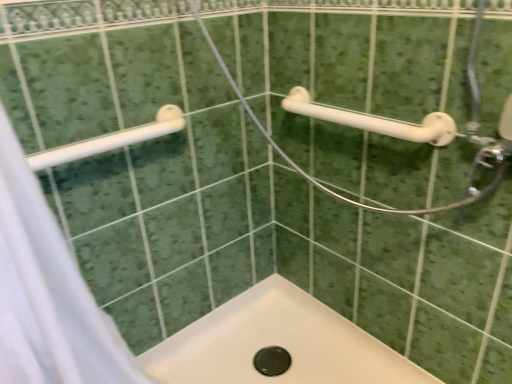
This screenshot has width=512, height=384. Identify the location of white plastic towel rack at upper left, the 2th towel rack viewed from the right. (111, 140).

What is the approximate width of white plastic towel rack at upper left, the 2th towel rack viewed from the right?

It is 4.54 inches.

Based on the photo, in order to face white fabric shower curtain at left, should I rotate leftwards or rightwards?

It's best to rotate left around 23.822 degrees.

The image size is (512, 384). Identify the location of white plastic towel rack at upper left, the 2th towel rack viewed from the right. (111, 140).

Considering the sizes of objects white fabric shower curtain at left and white plastic towel rack at upper left, the 2th towel rack viewed from the right, in the image provided, who is bigger, white fabric shower curtain at left or white plastic towel rack at upper left, the 2th towel rack viewed from the right,?

white fabric shower curtain at left is bigger.

What's the angular difference between white fabric shower curtain at left and white plastic towel rack at upper left, positioned as the 1th towel rack in left-to-right order,'s facing directions?

The facing directions of white fabric shower curtain at left and white plastic towel rack at upper left, positioned as the 1th towel rack in left-to-right order, are 3.91 degrees apart.

Which object is closer to the camera taking this photo, white fabric shower curtain at left or white plastic towel rack at upper left, positioned as the 1th towel rack in left-to-right order?

Positioned in front is white fabric shower curtain at left.

Consider the image. Is white fabric shower curtain at left next to white plastic towel rack at upper left, the 2th towel rack viewed from the right, and touching it?

No, white fabric shower curtain at left is not next to white plastic towel rack at upper left, the 2th towel rack viewed from the right.

Considering the points (14, 315) and (441, 132), which point is behind, point (14, 315) or point (441, 132)?

The point (441, 132) is behind.

From the image's perspective, which is above, white fabric shower curtain at left or white plastic grab bar at upper right, acting as the first towel rack starting from the right?

white plastic grab bar at upper right, acting as the first towel rack starting from the right, from the image's perspective.

Is the depth of white fabric shower curtain at left less than that of white plastic grab bar at upper right, acting as the first towel rack starting from the right?

Yes, the depth of white fabric shower curtain at left is less than that of white plastic grab bar at upper right, acting as the first towel rack starting from the right.

Consider the image. Are white fabric shower curtain at left and white plastic grab bar at upper right, placed as the 2th towel rack when sorted from left to right, far apart?

white fabric shower curtain at left is near white plastic grab bar at upper right, placed as the 2th towel rack when sorted from left to right, not far away.

Does white plastic grab bar at upper right, placed as the 2th towel rack when sorted from left to right, touch white plastic towel rack at upper left, the 2th towel rack viewed from the right?

white plastic grab bar at upper right, placed as the 2th towel rack when sorted from left to right, and white plastic towel rack at upper left, the 2th towel rack viewed from the right, are clearly separated.

Can you confirm if white plastic grab bar at upper right, acting as the first towel rack starting from the right, is shorter than white plastic towel rack at upper left, the 2th towel rack viewed from the right?

Incorrect, the height of white plastic grab bar at upper right, acting as the first towel rack starting from the right, does not fall short of that of white plastic towel rack at upper left, the 2th towel rack viewed from the right.

From the image's perspective, is white plastic grab bar at upper right, acting as the first towel rack starting from the right, below white plastic towel rack at upper left, positioned as the 1th towel rack in left-to-right order?

No.

Between white plastic grab bar at upper right, acting as the first towel rack starting from the right, and white plastic towel rack at upper left, positioned as the 1th towel rack in left-to-right order, which one appears on the left side from the viewer's perspective?

white plastic towel rack at upper left, positioned as the 1th towel rack in left-to-right order, is more to the left.

Which is more to the right, white plastic towel rack at upper left, the 2th towel rack viewed from the right, or white plastic grab bar at upper right, placed as the 2th towel rack when sorted from left to right?

white plastic grab bar at upper right, placed as the 2th towel rack when sorted from left to right.

Is white plastic towel rack at upper left, the 2th towel rack viewed from the right, aimed at white plastic grab bar at upper right, acting as the first towel rack starting from the right?

No.

Is white plastic grab bar at upper right, placed as the 2th towel rack when sorted from left to right, located within white plastic towel rack at upper left, positioned as the 1th towel rack in left-to-right order?

No, white plastic grab bar at upper right, placed as the 2th towel rack when sorted from left to right, is not surrounded by white plastic towel rack at upper left, positioned as the 1th towel rack in left-to-right order.

From the image's perspective, is white plastic towel rack at upper left, positioned as the 1th towel rack in left-to-right order, located beneath white plastic grab bar at upper right, acting as the first towel rack starting from the right?

Correct, white plastic towel rack at upper left, positioned as the 1th towel rack in left-to-right order, appears lower than white plastic grab bar at upper right, acting as the first towel rack starting from the right, in the image.

From a real-world perspective, relative to white fabric shower curtain at left, is white plastic towel rack at upper left, the 2th towel rack viewed from the right, vertically above or below?

From a real-world perspective, white plastic towel rack at upper left, the 2th towel rack viewed from the right, is physically above white fabric shower curtain at left.

Does white plastic towel rack at upper left, the 2th towel rack viewed from the right, come in front of white fabric shower curtain at left?

No, the depth of white plastic towel rack at upper left, the 2th towel rack viewed from the right, is greater than that of white fabric shower curtain at left.

Can white fabric shower curtain at left be found inside white plastic towel rack at upper left, positioned as the 1th towel rack in left-to-right order?

No, white fabric shower curtain at left is located outside of white plastic towel rack at upper left, positioned as the 1th towel rack in left-to-right order.

Is point (112, 147) behind point (124, 367)?

No, it is not.

Which is behind, point (384, 124) or point (51, 221)?

Point (384, 124)

Considering the sizes of white plastic grab bar at upper right, acting as the first towel rack starting from the right, and white fabric shower curtain at left in the image, is white plastic grab bar at upper right, acting as the first towel rack starting from the right, wider or thinner than white fabric shower curtain at left?

Considering their sizes, white plastic grab bar at upper right, acting as the first towel rack starting from the right, looks slimmer than white fabric shower curtain at left.

Does white plastic grab bar at upper right, placed as the 2th towel rack when sorted from left to right, lie in front of white fabric shower curtain at left?

No, the depth of white plastic grab bar at upper right, placed as the 2th towel rack when sorted from left to right, is greater than that of white fabric shower curtain at left.

Is white plastic grab bar at upper right, placed as the 2th towel rack when sorted from left to right, at the left side of white fabric shower curtain at left?

In fact, white plastic grab bar at upper right, placed as the 2th towel rack when sorted from left to right, is to the right of white fabric shower curtain at left.

From a real-world perspective, which towel rack is the 2nd one above the white fabric shower curtain at left? Please provide its 2D coordinates.

[(111, 140)]

Locate an element on the screen. The image size is (512, 384). shower curtain on the left of the white plastic grab bar at upper right, placed as the 2th towel rack when sorted from left to right is located at coordinates (47, 292).

Considering their positions, is white plastic towel rack at upper left, positioned as the 1th towel rack in left-to-right order, positioned further to white plastic grab bar at upper right, placed as the 2th towel rack when sorted from left to right, than white fabric shower curtain at left?

The object further to white plastic grab bar at upper right, placed as the 2th towel rack when sorted from left to right, is white fabric shower curtain at left.

Which object lies nearer to the anchor point white plastic towel rack at upper left, the 2th towel rack viewed from the right, white plastic grab bar at upper right, acting as the first towel rack starting from the right, or white fabric shower curtain at left?

The object closer to white plastic towel rack at upper left, the 2th towel rack viewed from the right, is white fabric shower curtain at left.

From the image, which object appears to be farther from white plastic grab bar at upper right, placed as the 2th towel rack when sorted from left to right, white fabric shower curtain at left or white plastic towel rack at upper left, the 2th towel rack viewed from the right?

white fabric shower curtain at left lies further to white plastic grab bar at upper right, placed as the 2th towel rack when sorted from left to right, than the other object.

Considering their positions, is white fabric shower curtain at left positioned closer to white plastic towel rack at upper left, the 2th towel rack viewed from the right, than white plastic grab bar at upper right, acting as the first towel rack starting from the right?

The object closer to white plastic towel rack at upper left, the 2th towel rack viewed from the right, is white fabric shower curtain at left.

Looking at the image, which one is located further to white fabric shower curtain at left, white plastic towel rack at upper left, positioned as the 1th towel rack in left-to-right order, or white plastic grab bar at upper right, acting as the first towel rack starting from the right?

Based on the image, white plastic grab bar at upper right, acting as the first towel rack starting from the right, appears to be further to white fabric shower curtain at left.

From the image, which object appears to be nearer to white fabric shower curtain at left, white plastic grab bar at upper right, acting as the first towel rack starting from the right, or white plastic towel rack at upper left, positioned as the 1th towel rack in left-to-right order?

Among the two, white plastic towel rack at upper left, positioned as the 1th towel rack in left-to-right order, is located nearer to white fabric shower curtain at left.

Image resolution: width=512 pixels, height=384 pixels. I want to click on towel rack situated between white fabric shower curtain at left and white plastic grab bar at upper right, placed as the 2th towel rack when sorted from left to right, from left to right, so click(111, 140).